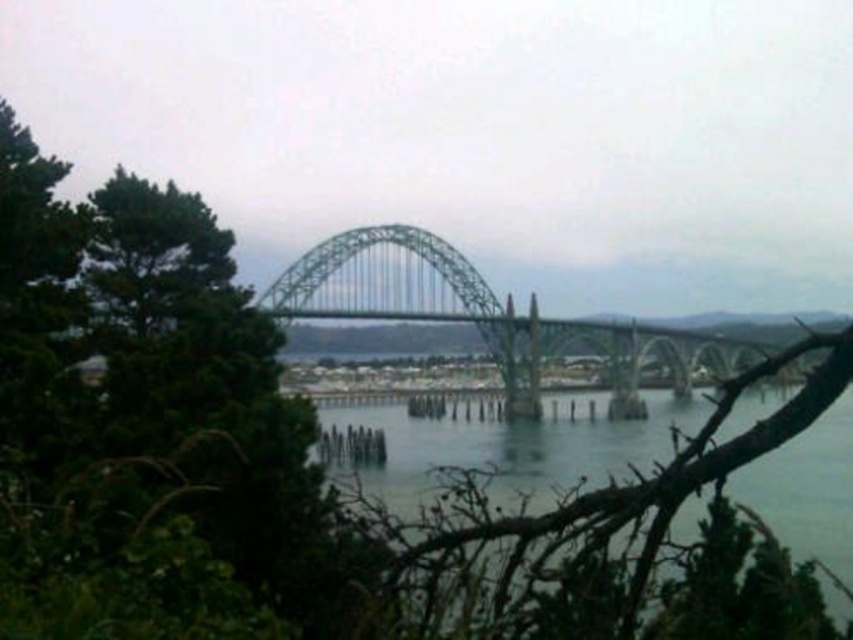
You are a photographer aiming to capture the green metallic bridge at center and the clear water at center in a single shot. Based on their positions, which object should you adjust your camera to focus on first if you want to include both in your frame?

The clear water at center is to the left of green metallic bridge at center, so you should focus on the clear water at center first to ensure both objects are included in the frame.

You are standing at the base of the bridge in the image and want to walk towards the point labeled as point [339,412]. Will you pass by point [419,266] before reaching your destination?

Yes, you will pass by point [419,266] before reaching point [339,412] because point [339,412] is in front of point [419,266], meaning point [419,266] is behind it from your perspective.